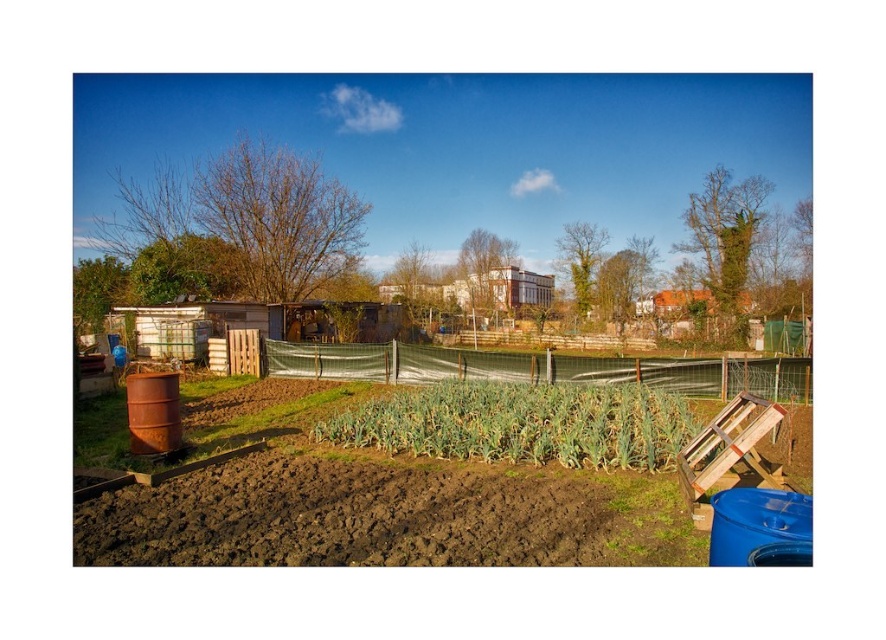
In the garden scene, you see the brown soil at center and the green mesh fence at center. Which object is positioned to the left of the other?

The brown soil at center is to the left of green mesh fence at center.

You are a gardener who wants to water the green leafy plant at center and the green mesh fence at center. Which one should you water first if you want to avoid getting the fence wet?

You should water the green leafy plant at center first because it is below the green mesh fence at center. Watering the fence after might cause water to drip onto the plant, but since the plant is lower, watering it first won t affect the fence.